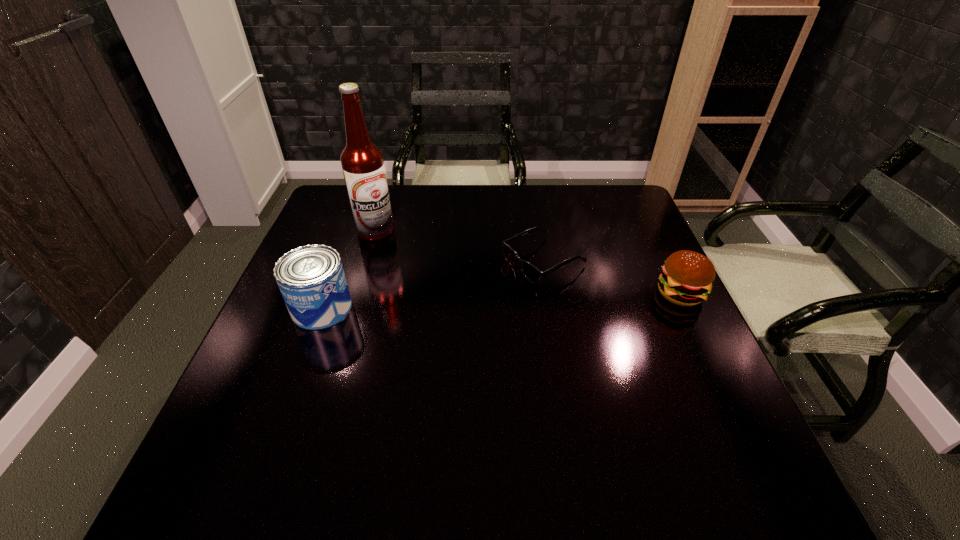
Find the location of a particular element. Image resolution: width=960 pixels, height=540 pixels. vacant area located at the front lenses of the sunglasses is located at coordinates (476, 294).

Find the location of a particular element. This screenshot has width=960, height=540. free space located 0.330m on the label side of the tallest object is located at coordinates (485, 281).

At what (x,y) coordinates should I click in order to perform the action: click on blank area located 0.270m on the label side of the tallest object. Please return your answer as a coordinate pair (x, y). Looking at the image, I should click on (466, 272).

Identify the location of free region located on the label side of the tallest object. (436, 258).

Locate an element on the screen. object present at the far edge is located at coordinates (362, 162).

Where is `can that is at the left edge`? The height and width of the screenshot is (540, 960). can that is at the left edge is located at coordinates (311, 278).

At what (x,y) coordinates should I click in order to perform the action: click on alcohol that is at the left edge. Please return your answer as a coordinate pair (x, y). The width and height of the screenshot is (960, 540). Looking at the image, I should click on (362, 162).

The width and height of the screenshot is (960, 540). What are the coordinates of `object positioned at the right edge` in the screenshot? It's located at (687, 277).

Where is `object located at the far left corner`? This screenshot has height=540, width=960. object located at the far left corner is located at coordinates (362, 162).

Find the location of `free space at the far edge of the desktop`. free space at the far edge of the desktop is located at coordinates (451, 209).